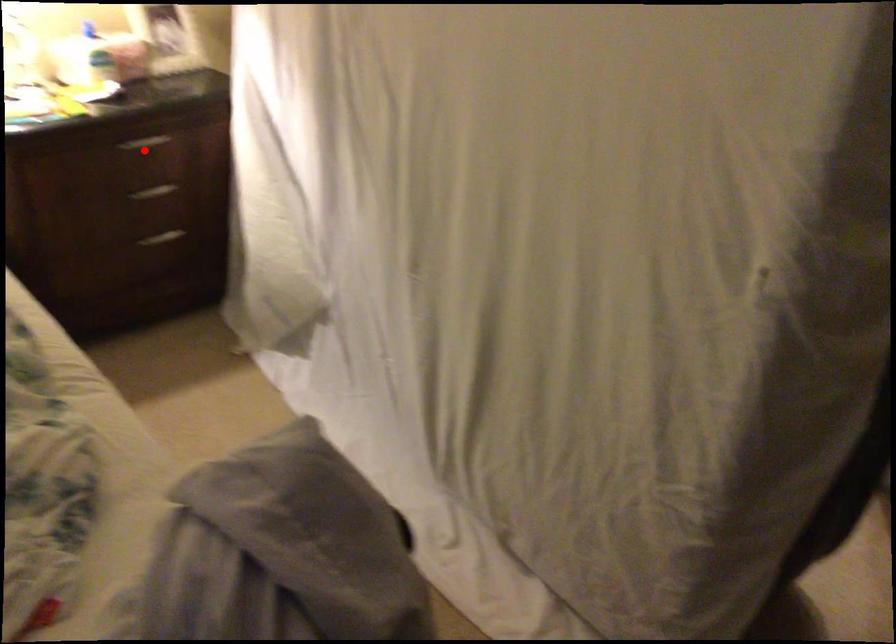
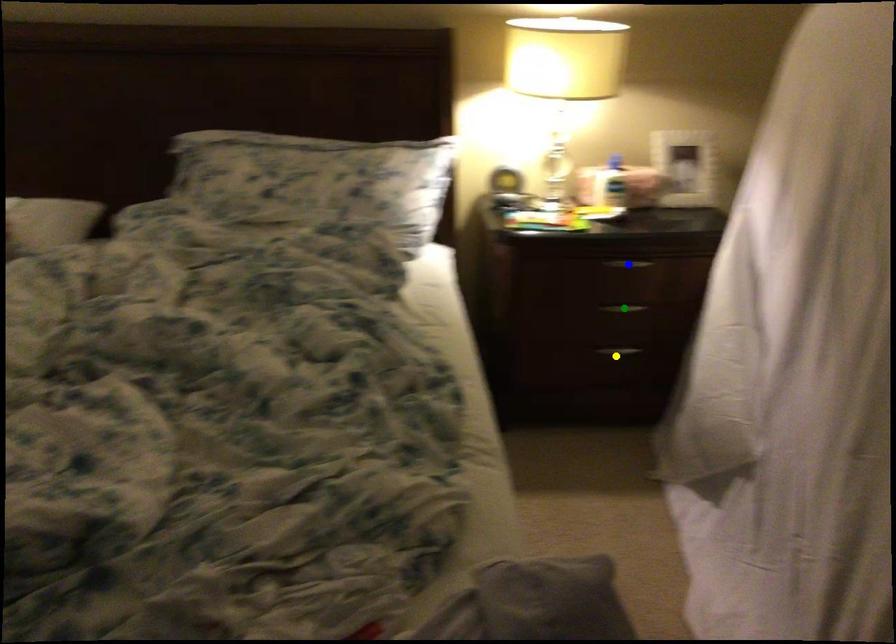
Question: I am providing you with two images of the same scene from different viewpoints. A red point is marked on the first image. You are given multiple points on the second image. Which spot in image 2 lines up with the point in image 1?

Choices:
 (A) green point
 (B) yellow point
 (C) blue point

Answer: (C)